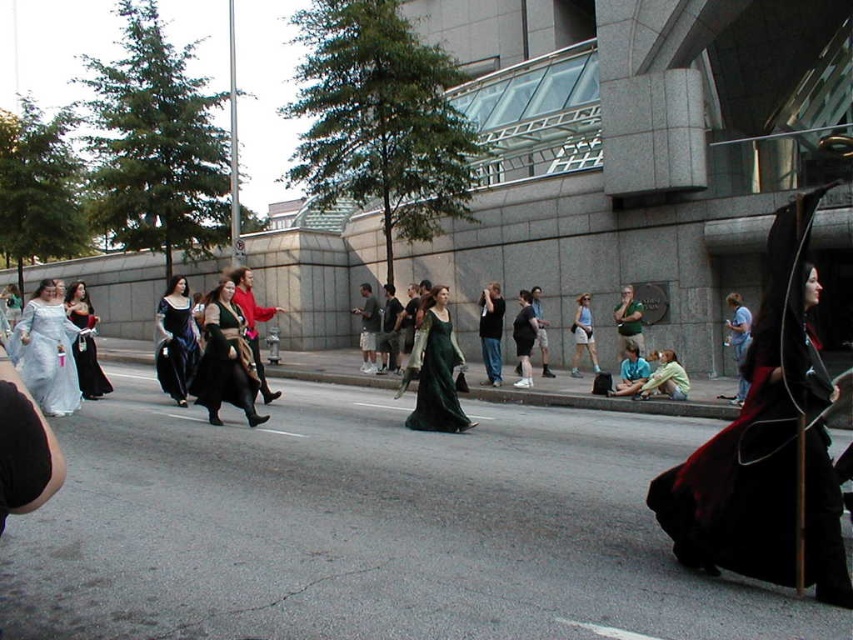
You are a photographer positioned at the center of the scene. You need to capture a photo that includes both the matte black dress at left and the modern building in the background. Which direction should you move to ensure both are in frame?

The matte black dress at left is located at point (x=85, y=342), so you should move to the left to include both the matte black dress at left and the modern building in the background.

You are standing at the origin point of the coordinate system and want to locate the green velvet gown at center. What are its coordinates?

The green velvet gown at center is located at coordinates point [434,369].

Consider the image. You are standing at the center of the street looking towards the building. There are two points marked in the image. Which point, point [811,406] or point [82,285], is closer to you?

Point [811,406] is closer to the camera than point [82,285], so it is closer to you.